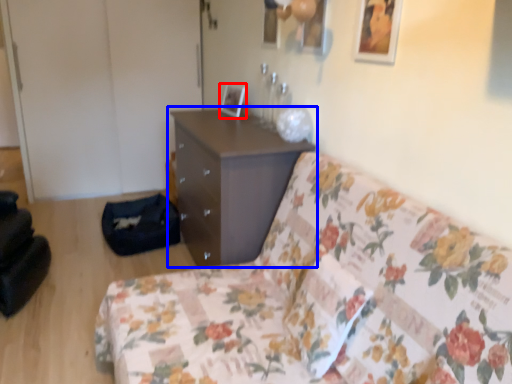
Question: Which of the following is the farthest to the observer, picture frame (highlighted by a red box) or chest of drawers (highlighted by a blue box)?

Choices:
 (A) picture frame
 (B) chest of drawers

Answer: (A)